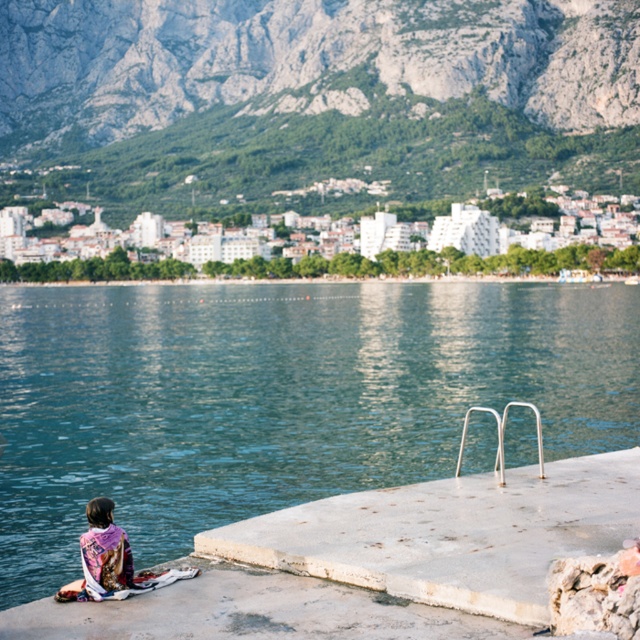
You are standing at the edge of the pier and want to reach a specific point marked at coordinates point (113,440). Given that you can walk 100 feet per minute, how many minutes will it take you to reach that point?

The point (113,440) is 223.85 feet away from the viewer. At a walking speed of 100 feet per minute, it will take approximately 2.24 minutes to reach the point. Since you can walk 100 feet in a minute, 223.85 divided by 100 equals 2.2385, which rounds to 2.24 minutes.

You are standing at the end of the pier and want to take a photo of the gray rocky mountain at upper center. The camera you have can focus on objects up to 200 meters away. Will the mountain be in focus?

The gray rocky mountain at upper center is 206.22 meters away from the camera, which is beyond the camera maximum focus range of 200 meters. Therefore, the mountain will not be in focus.